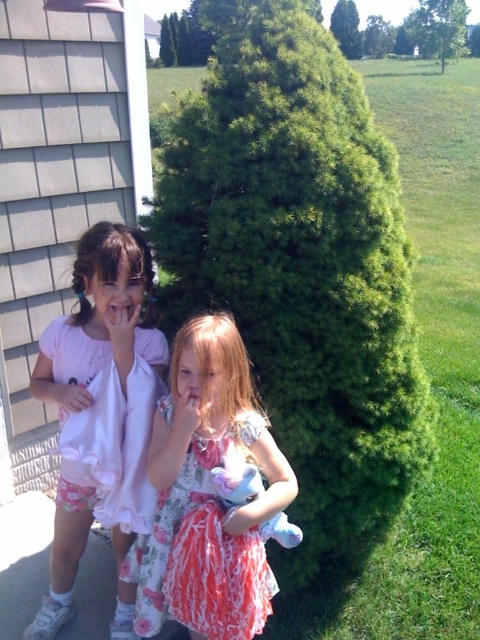
You are standing in the scene and want to move from the point at coordinates point (327, 442) to the point at coordinates point (132, 410). Which direction should you face to walk towards the second point?

Since point (327, 442) is further to the viewer than point (132, 410), you should face away from the viewer to move towards the second point.

You are a photographer setting up for a photoshoot. You need to place a 1.2 meter wide backdrop behind the green leafy bush at center and the pink satin dress at left. Which object requires a wider backdrop to fully capture its width?

The green leafy bush at center requires a wider backdrop because its width surpasses the pink satin dress at left.